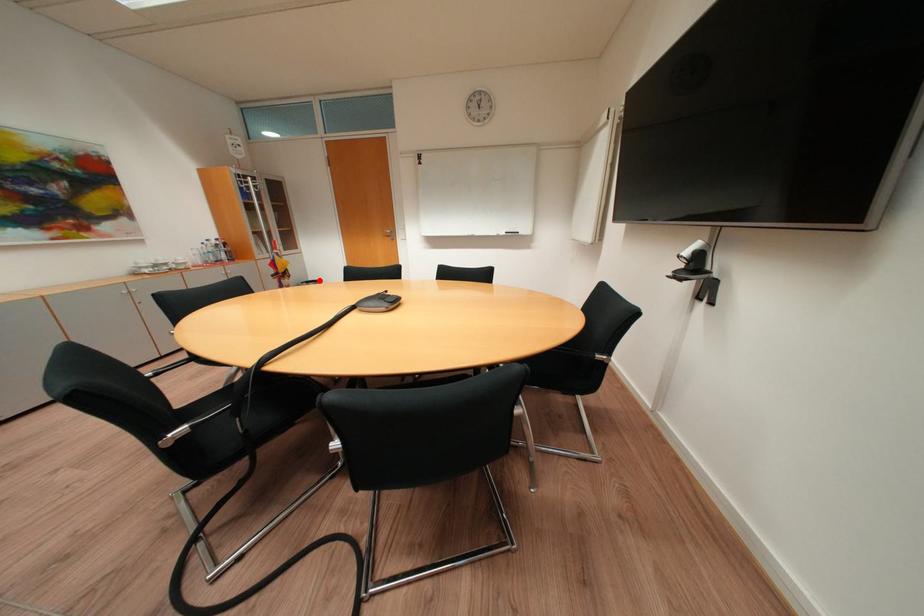
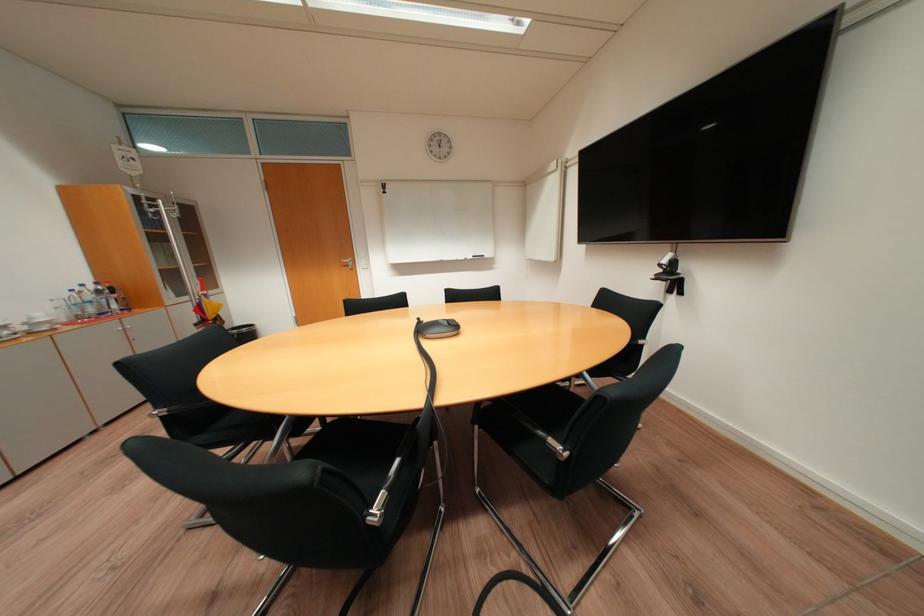
In the second image, find the point that corresponds to the highlighted location in the first image.

(246, 326)